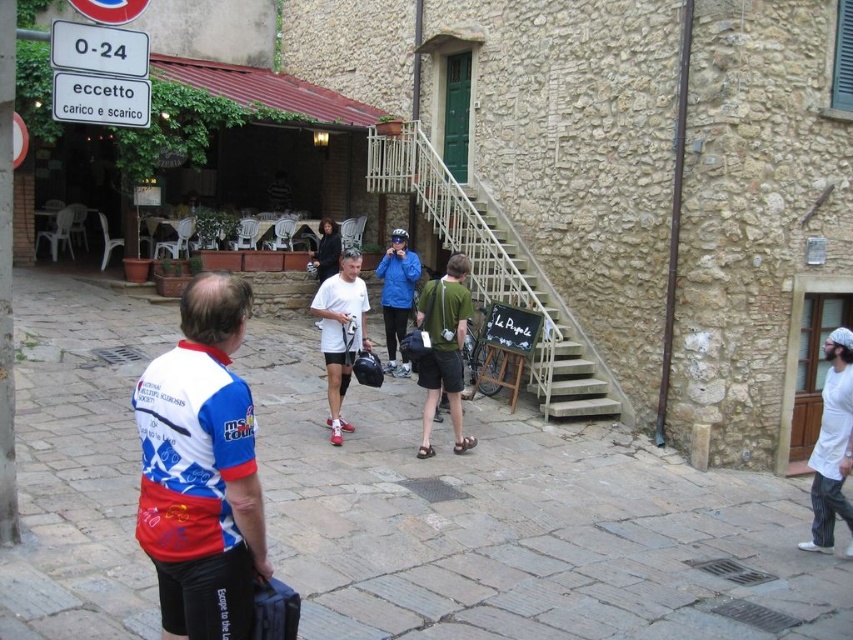
Between white cotton chef's coat at right and white matte t-shirt at center, which one appears on the right side from the viewer's perspective?

Positioned to the right is white cotton chef's coat at right.

The width and height of the screenshot is (853, 640). Describe the element at coordinates (833, 444) in the screenshot. I see `white cotton chef's coat at right` at that location.

In order to click on white cotton chef's coat at right in this screenshot , I will do `click(833, 444)`.

Between point (138, 307) and point (322, 252), which one is positioned behind?

Positioned behind is point (322, 252).

Is point (639, 620) farther from camera compared to point (337, 268)?

No, it is not.

Identify the location of brown stone pavement at center. This screenshot has height=640, width=853. (519, 524).

Is white jersey at center to the right of green fabric shirt at center from the viewer's perspective?

No, white jersey at center is not to the right of green fabric shirt at center.

Is white jersey at center closer to camera compared to green fabric shirt at center?

Yes, white jersey at center is closer to the viewer.

This screenshot has height=640, width=853. Identify the location of white jersey at center. (201, 468).

This screenshot has height=640, width=853. Find the location of `white jersey at center`. white jersey at center is located at coordinates (201, 468).